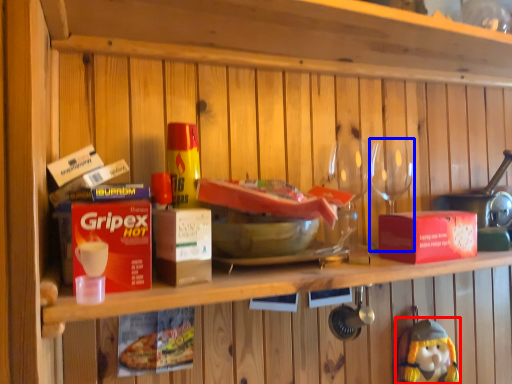
Question: Which object is further to the camera taking this photo, figurine (highlighted by a red box) or tableware (highlighted by a blue box)?

Choices:
 (A) figurine
 (B) tableware

Answer: (A)